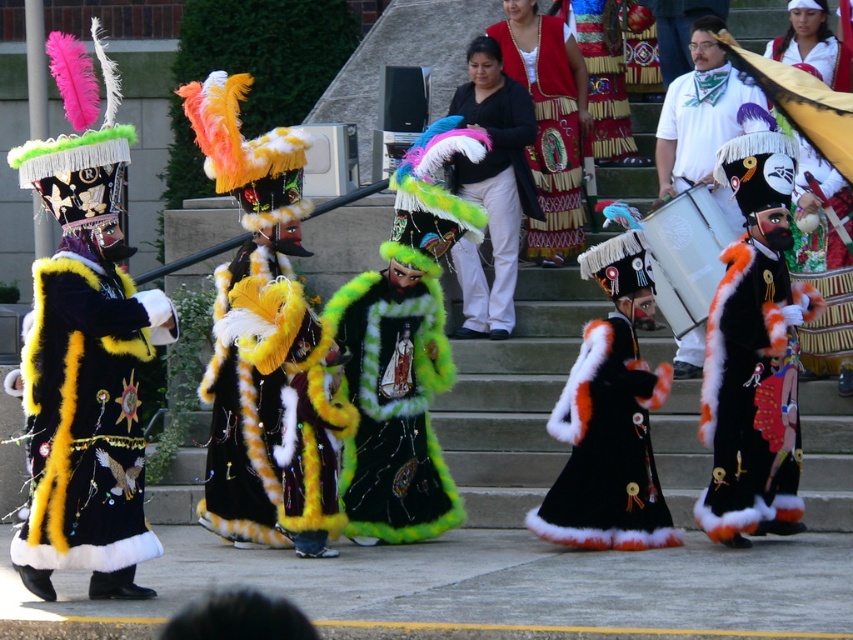
Does point (766, 490) come behind point (573, 228)?

No, it is not.

Locate an element on the screen. black velvet coat with fur trim at center is located at coordinates (752, 396).

Is point (107, 552) farther from viewer compared to point (552, 252)?

No, (107, 552) is closer to viewer.

Does black fur robe at left appear over embroidered velvet dress at center?

No.

What do you see at coordinates (86, 416) in the screenshot? Image resolution: width=853 pixels, height=640 pixels. I see `black fur robe at left` at bounding box center [86, 416].

I want to click on black fur robe at left, so click(x=86, y=416).

Does black velvet coat with fur trim at center appear on the left side of green fuzzy coat at center?

Incorrect, black velvet coat with fur trim at center is not on the left side of green fuzzy coat at center.

Which is above, black velvet coat with fur trim at center or green fuzzy coat at center?

black velvet coat with fur trim at center

You are a GUI agent. You are given a task and a screenshot of the screen. Output one action in this format:
    pyautogui.click(x=<x>, y=<y>)
    Task: Click on the black velvet coat with fur trim at center
    The image size is (853, 640).
    Given the screenshot: What is the action you would take?
    pyautogui.click(x=752, y=396)